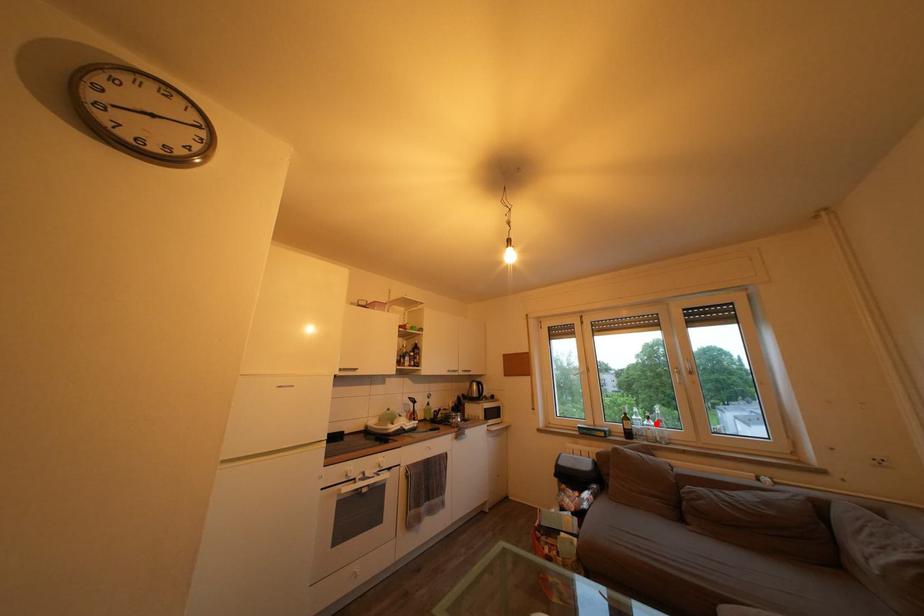
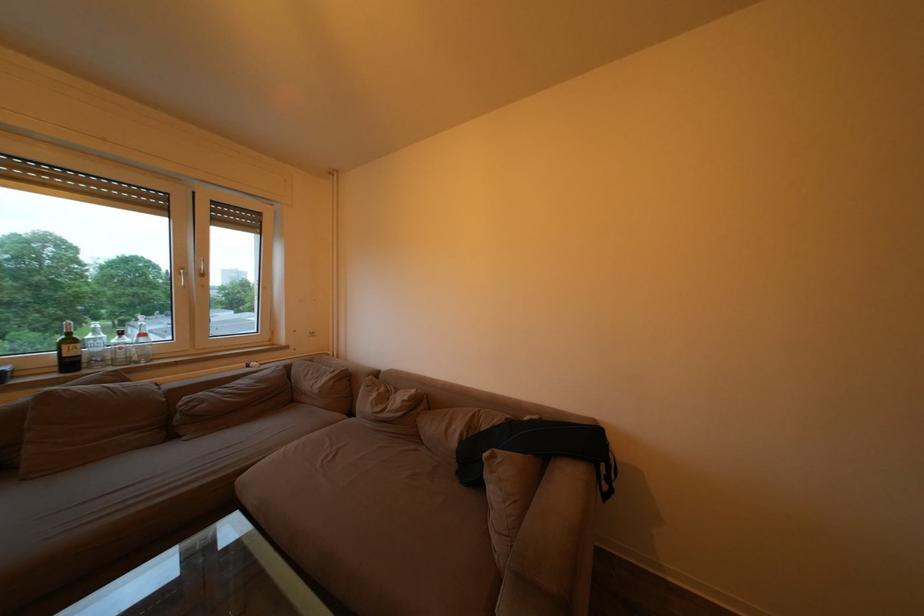
Find the pixel in the second image that matches the highlighted location in the first image.

(129, 339)